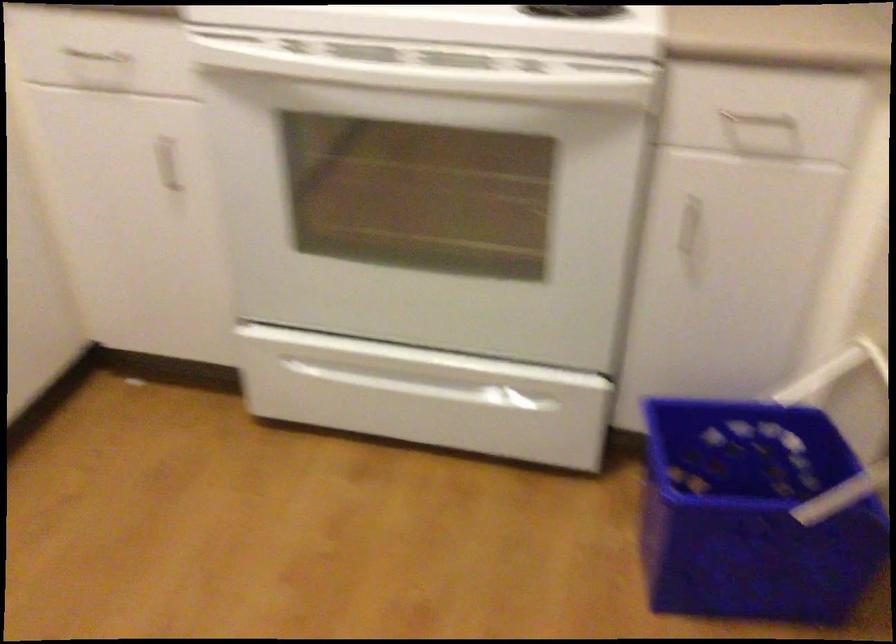
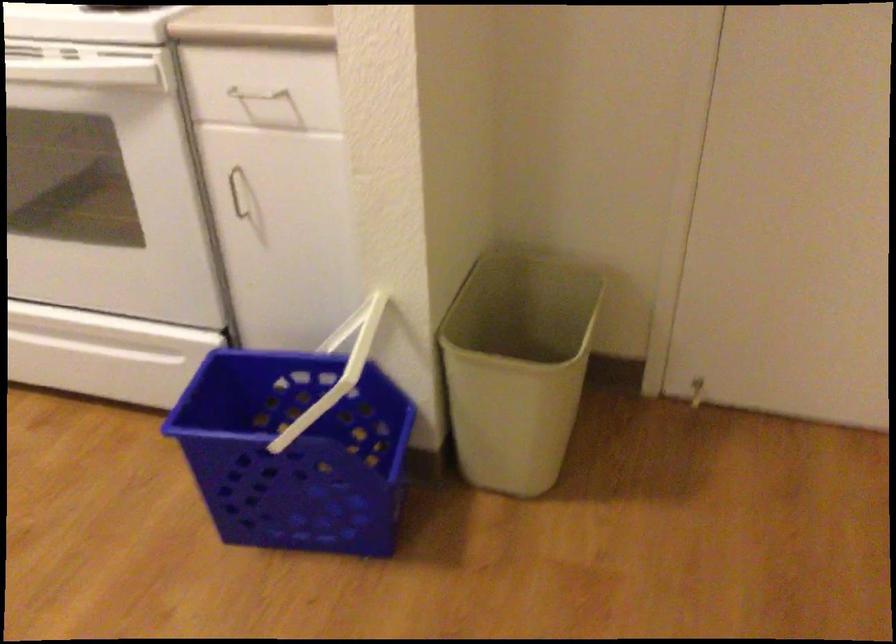
Question: The camera is either moving clockwise (left) or counter-clockwise (right) around the object. The first image is from the beginning of the video and the second image is from the end. Is the camera moving left or right when shooting the video?

Choices:
 (A) Left
 (B) Right

Answer: (B)